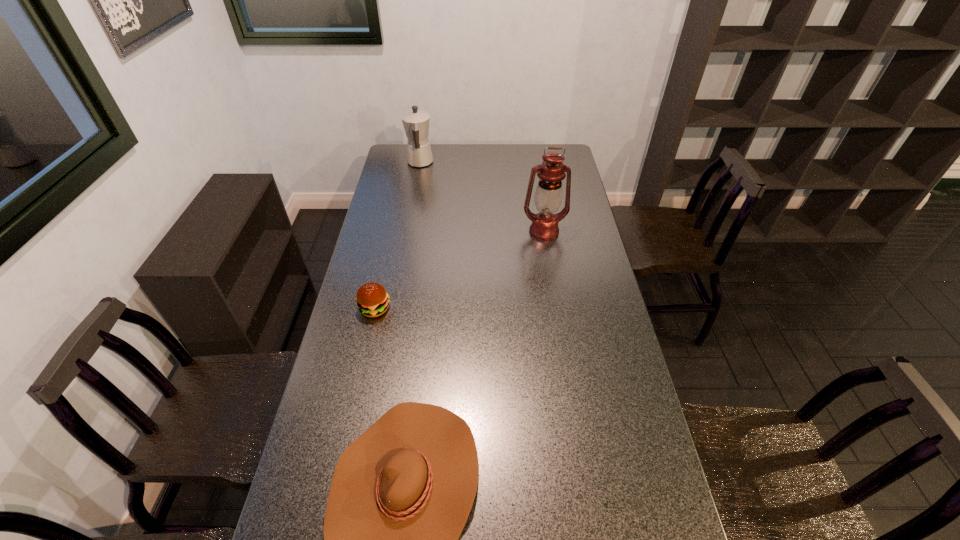
Identify the location of free space between the second shortest object and the second farthest object. The image size is (960, 540). (460, 270).

This screenshot has height=540, width=960. I want to click on free space between the third nearest object and the hamburger, so click(x=460, y=270).

The height and width of the screenshot is (540, 960). In order to click on object that stands as the closest to the third shortest object in this screenshot , I will do `click(548, 196)`.

Locate which object is the third closest to the cowboy hat. Please provide its 2D coordinates. Your answer should be formatted as a tuple, i.e. [(x, y)], where the tuple contains the x and y coordinates of a point satisfying the conditions above.

[(416, 122)]

Where is `free location that satisfies the following two spatial constraints: 1. on the back side of the farthest object; 2. on the left side of the third tallest object`? Image resolution: width=960 pixels, height=540 pixels. free location that satisfies the following two spatial constraints: 1. on the back side of the farthest object; 2. on the left side of the third tallest object is located at coordinates (407, 163).